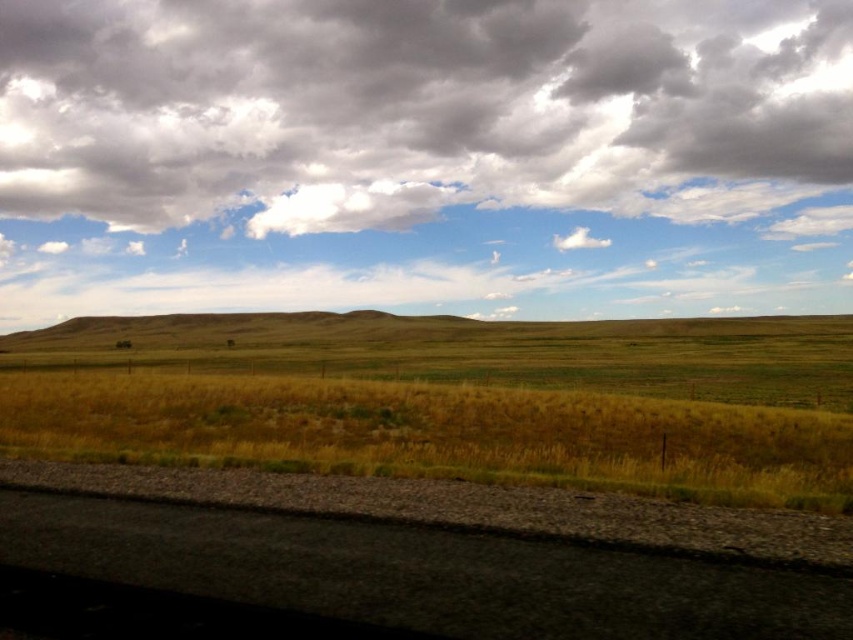
Does yellow dry grass at center appear on the left side of black asphalt train track at lower left?

In fact, yellow dry grass at center is to the right of black asphalt train track at lower left.

Which of these two, yellow dry grass at center or black asphalt train track at lower left, stands taller?

yellow dry grass at center is taller.

Which is in front, point (608, 416) or point (198, 540)?

Point (198, 540) is more forward.

The width and height of the screenshot is (853, 640). Find the location of `yellow dry grass at center`. yellow dry grass at center is located at coordinates (451, 400).

Can you confirm if cloudy sky at upper center is thinner than black asphalt train track at lower left?

No, cloudy sky at upper center is not thinner than black asphalt train track at lower left.

Does cloudy sky at upper center appear on the left side of black asphalt train track at lower left?

In fact, cloudy sky at upper center is to the right of black asphalt train track at lower left.

Locate an element on the screen. This screenshot has height=640, width=853. cloudy sky at upper center is located at coordinates (418, 108).

Does cloudy sky at upper center have a smaller size compared to yellow dry grass at center?

No, cloudy sky at upper center is not smaller than yellow dry grass at center.

Describe the element at coordinates (418, 108) in the screenshot. The image size is (853, 640). I see `cloudy sky at upper center` at that location.

Locate an element on the screen. cloudy sky at upper center is located at coordinates (418, 108).